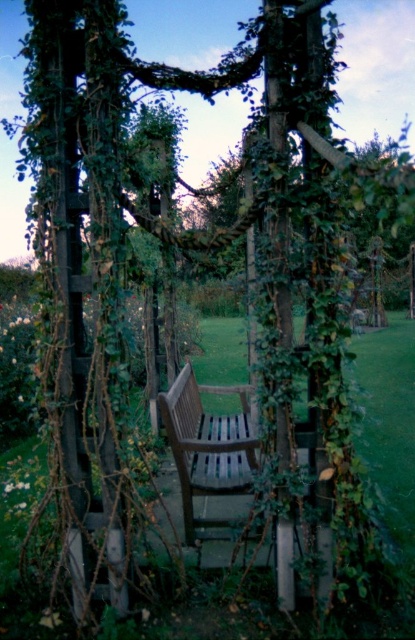
Does green grass at center have a smaller size compared to wooden bench at center?

Incorrect, green grass at center is not smaller in size than wooden bench at center.

Can you confirm if green grass at center is positioned to the right of wooden bench at center?

Indeed, green grass at center is positioned on the right side of wooden bench at center.

Is point (400, 410) positioned after point (219, 416)?

Yes, it is.

Where is `green grass at center`? The height and width of the screenshot is (640, 415). green grass at center is located at coordinates click(x=390, y=424).